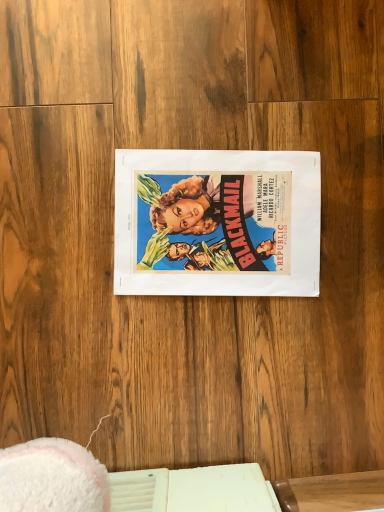
The height and width of the screenshot is (512, 384). What do you see at coordinates (217, 223) in the screenshot?
I see `vibrant paper poster at center` at bounding box center [217, 223].

Find the location of a particular element. vibrant paper poster at center is located at coordinates (217, 223).

This screenshot has height=512, width=384. Find the location of `wooden table at center`. wooden table at center is located at coordinates (332, 492).

What is the approximate height of wooden table at center?

5.48 centimeters.

What do you see at coordinates (332, 492) in the screenshot? Image resolution: width=384 pixels, height=512 pixels. I see `wooden table at center` at bounding box center [332, 492].

The width and height of the screenshot is (384, 512). Identify the location of vibrant paper poster at center. (217, 223).

Between vibrant paper poster at center and wooden table at center, which one appears on the right side from the viewer's perspective?

wooden table at center.

Is vibrant paper poster at center in front of or behind wooden table at center in the image?

vibrant paper poster at center is positioned farther from the viewer than wooden table at center.

Which is in front, point (137, 241) or point (297, 479)?

The point (297, 479) is closer.

From the image's perspective, which one is positioned higher, vibrant paper poster at center or wooden table at center?

vibrant paper poster at center, from the image's perspective.

From a real-world perspective, is vibrant paper poster at center beneath wooden table at center?

Yes, from a real-world perspective, vibrant paper poster at center is beneath wooden table at center.

Between vibrant paper poster at center and wooden table at center, which one has smaller width?

wooden table at center.

Is vibrant paper poster at center taller or shorter than wooden table at center?

vibrant paper poster at center is shorter than wooden table at center.

Considering the sizes of objects vibrant paper poster at center and wooden table at center in the image provided, who is smaller, vibrant paper poster at center or wooden table at center?

With smaller size is wooden table at center.

Consider the image. Is wooden table at center a part of vibrant paper poster at center?

Definitely not — wooden table at center is not inside vibrant paper poster at center.

Is vibrant paper poster at center next to wooden table at center and touching it?

vibrant paper poster at center and wooden table at center are not in contact.

Could you tell me if vibrant paper poster at center is turned towards wooden table at center?

No, vibrant paper poster at center is not turned towards wooden table at center.

What's the angular difference between vibrant paper poster at center and wooden table at center's facing directions?

vibrant paper poster at center and wooden table at center are facing 86.3 degrees away from each other.

How distant is vibrant paper poster at center from wooden table at center?

vibrant paper poster at center is 14.47 inches from wooden table at center.

You are a GUI agent. You are given a task and a screenshot of the screen. Output one action in this format:
    pyautogui.click(x=<x>, y=<y>)
    Task: Click on the paperback book that is under the wooden table at center (from a real-world perspective)
    The height and width of the screenshot is (512, 384).
    Given the screenshot: What is the action you would take?
    pyautogui.click(x=217, y=223)

In the image, is wooden table at center on the left side or the right side of vibrant paper poster at center?

From the image, it's evident that wooden table at center is to the right of vibrant paper poster at center.

Which object is further away from the camera taking this photo, wooden table at center or vibrant paper poster at center?

vibrant paper poster at center is behind.

Considering the positions of point (378, 478) and point (283, 224), is point (378, 478) closer or farther from the camera than point (283, 224)?

Point (378, 478) is positioned closer to the camera compared to point (283, 224).

From the image's perspective, is wooden table at center above vibrant paper poster at center?

No, from the image's perspective, wooden table at center is not over vibrant paper poster at center.

Based on the photo, from a real-world perspective, is wooden table at center physically below vibrant paper poster at center?

Actually, wooden table at center is physically above vibrant paper poster at center in the real world.

Considering the sizes of objects wooden table at center and vibrant paper poster at center in the image provided, who is wider, wooden table at center or vibrant paper poster at center?

With larger width is vibrant paper poster at center.

Which of these two, wooden table at center or vibrant paper poster at center, stands shorter?

With less height is vibrant paper poster at center.

Considering the sizes of objects wooden table at center and vibrant paper poster at center in the image provided, who is bigger, wooden table at center or vibrant paper poster at center?

Bigger between the two is vibrant paper poster at center.

Choose the correct answer: Is wooden table at center inside vibrant paper poster at center or outside it?

wooden table at center is located beyond the bounds of vibrant paper poster at center.

Is wooden table at center touching vibrant paper poster at center?

There is a gap between wooden table at center and vibrant paper poster at center.

Is wooden table at center turned away from vibrant paper poster at center?

wooden table at center is not turned away from vibrant paper poster at center.

How different are the orientations of wooden table at center and vibrant paper poster at center in degrees?

They differ by 86.3 degrees in their facing directions.

There is a vibrant paper poster at center. Where is `table above it (from a real-world perspective)`? The height and width of the screenshot is (512, 384). table above it (from a real-world perspective) is located at coordinates (332, 492).

Find the location of `paperback book directly beneath the wooden table at center (from a real-world perspective)`. paperback book directly beneath the wooden table at center (from a real-world perspective) is located at coordinates (217, 223).

The image size is (384, 512). In order to click on paperback book on the left of wooden table at center in this screenshot , I will do `click(217, 223)`.